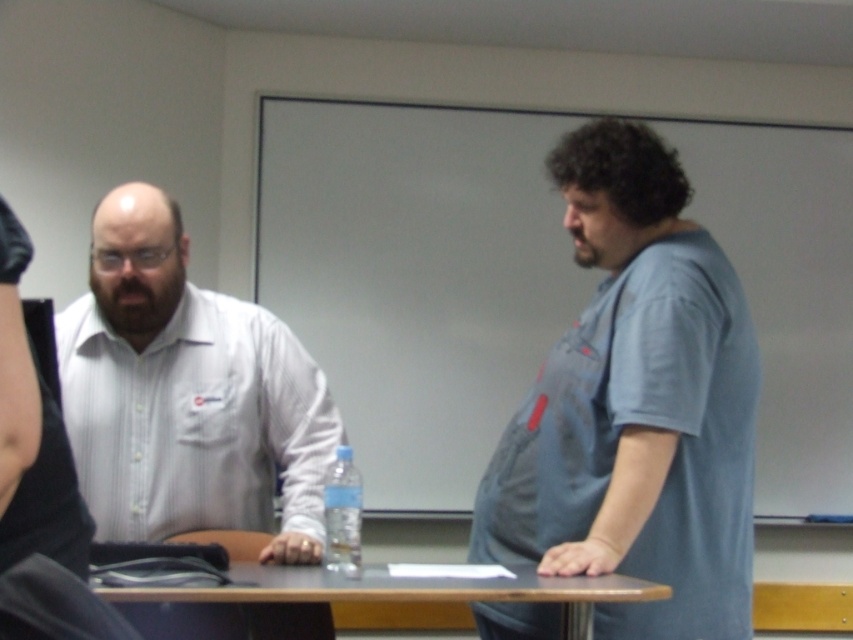
Is white striped shirt at left positioned before brown wood table at center?

No, it is not.

Measure the distance between point (123, 364) and camera.

Point (123, 364) is 2.06 meters from camera.

Does point (311, 493) come in front of point (257, 576)?

No, (311, 493) is behind (257, 576).

Find the location of a particular element. white striped shirt at left is located at coordinates (187, 397).

Does point (334, 252) come in front of point (256, 454)?

That is False.

Is whiteboard at upper center wider than white striped shirt at left?

Result: Indeed, whiteboard at upper center has a greater width compared to white striped shirt at left.

Describe the element at coordinates (416, 276) in the screenshot. The image size is (853, 640). I see `whiteboard at upper center` at that location.

Where is `whiteboard at upper center`? The image size is (853, 640). whiteboard at upper center is located at coordinates (416, 276).

Is point (849, 401) farther from camera compared to point (453, 588)?

Yes, point (849, 401) is farther from viewer.

Which is below, whiteboard at upper center or brown wood table at center?

brown wood table at center is below.

What do you see at coordinates (416, 276) in the screenshot? This screenshot has width=853, height=640. I see `whiteboard at upper center` at bounding box center [416, 276].

Find the location of a particular element. Image resolution: width=853 pixels, height=640 pixels. whiteboard at upper center is located at coordinates (416, 276).